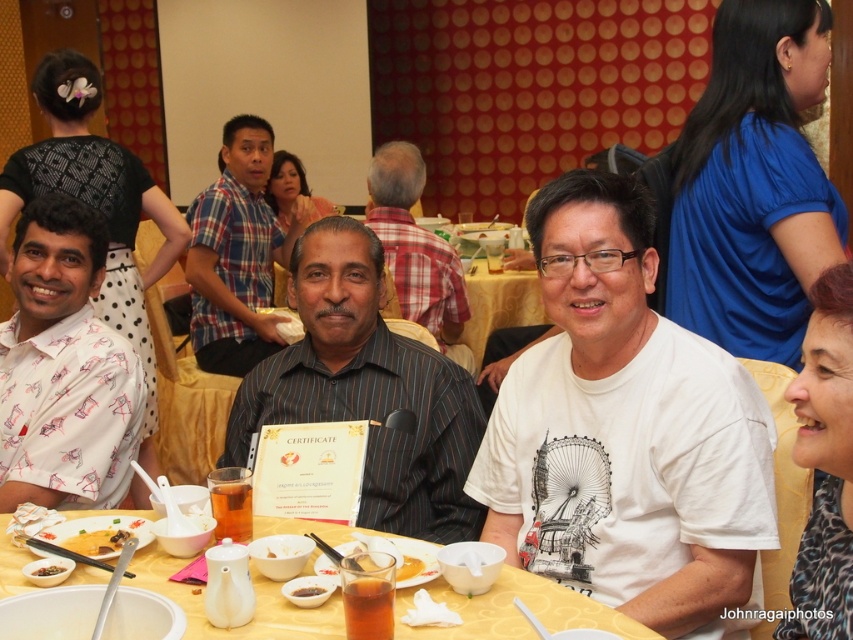
How distant is black striped shirt at center from white matte bowl at center?

black striped shirt at center and white matte bowl at center are 6.72 feet apart from each other.

Is black striped shirt at center further to the viewer compared to white matte bowl at center?

Yes, it is behind white matte bowl at center.

What do you see at coordinates (416, 250) in the screenshot?
I see `black striped shirt at center` at bounding box center [416, 250].

Locate an element on the screen. black striped shirt at center is located at coordinates (416, 250).

Is striped shirt at center above white matte bowl at center?

Correct, striped shirt at center is located above white matte bowl at center.

Can you confirm if striped shirt at center is wider than white matte bowl at center?

Correct, the width of striped shirt at center exceeds that of white matte bowl at center.

Between point (352, 300) and point (292, 547), which one is positioned in front?

Point (292, 547) is more forward.

This screenshot has width=853, height=640. I want to click on striped shirt at center, so click(x=368, y=390).

Is yellow plastic table at center bigger than yellow matte soup at center?

Yes, yellow plastic table at center is bigger than yellow matte soup at center.

Between point (544, 595) and point (421, 568), which one is positioned behind?

The point (421, 568) is more distant.

At what (x,y) coordinates should I click in order to perform the action: click on yellow plastic table at center. Please return your answer as a coordinate pair (x, y). Looking at the image, I should click on (515, 609).